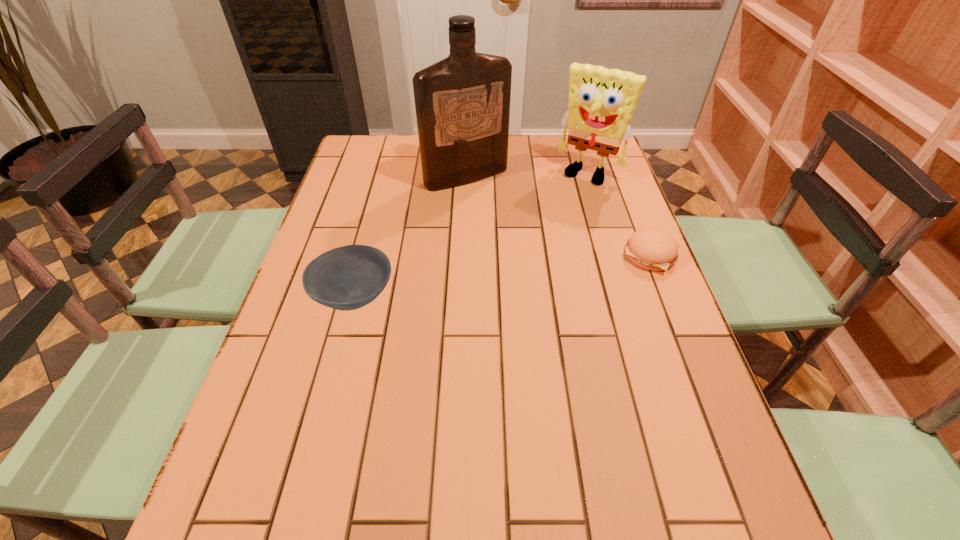
Locate an element on the screen. vacant space on the desktop that is between the bowl and the shortest object and is positioned on the label side of the tallest object is located at coordinates (546, 270).

At what (x,y) coordinates should I click in order to perform the action: click on free space on the desktop that is between the bowl and the shortest object and is positioned on the face of the second tallest object. Please return your answer as a coordinate pair (x, y). Looking at the image, I should click on (522, 273).